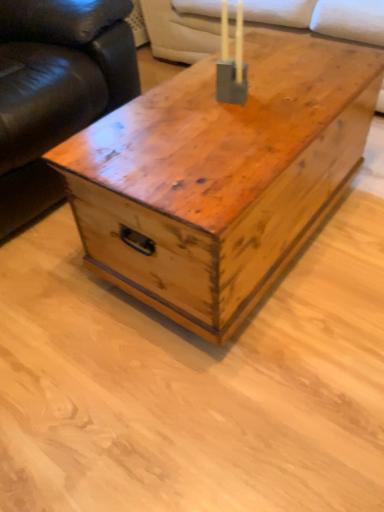
Describe the element at coordinates (321, 18) in the screenshot. I see `suede-like beige couch at upper center` at that location.

In order to face leather couch at left, should I rotate leftwards or rightwards?

Turn left approximately 25.000 degrees to face it.

Identify the location of wooden trunk at center. tap(220, 177).

What are the coordinates of `candle holder in front of the suede-like beige couch at upper center` in the screenshot? It's located at (231, 63).

From the image's perspective, is suede-like beige couch at upper center positioned above or below matte gray concrete candle holder at center?

suede-like beige couch at upper center is above matte gray concrete candle holder at center.

Considering the sizes of objects suede-like beige couch at upper center and matte gray concrete candle holder at center in the image provided, who is wider, suede-like beige couch at upper center or matte gray concrete candle holder at center?

With larger width is suede-like beige couch at upper center.

How different are the orientations of suede-like beige couch at upper center and matte gray concrete candle holder at center in degrees?

There is a 90.6-degree angle between the facing directions of suede-like beige couch at upper center and matte gray concrete candle holder at center.

Choose the correct answer: Is suede-like beige couch at upper center inside wooden trunk at center or outside it?

suede-like beige couch at upper center is located beyond the bounds of wooden trunk at center.

Does suede-like beige couch at upper center have a greater width compared to wooden trunk at center?

Correct, the width of suede-like beige couch at upper center exceeds that of wooden trunk at center.

Which object is positioned more to the right, suede-like beige couch at upper center or wooden trunk at center?

Positioned to the right is suede-like beige couch at upper center.

Does suede-like beige couch at upper center come behind wooden trunk at center?

Yes, it is behind wooden trunk at center.

Is matte gray concrete candle holder at center oriented away from suede-like beige couch at upper center?

That's not correct — matte gray concrete candle holder at center is not looking away from suede-like beige couch at upper center.

Which object is positioned more to the right, matte gray concrete candle holder at center or suede-like beige couch at upper center?

suede-like beige couch at upper center is more to the right.

From the image's perspective, which object appears higher, matte gray concrete candle holder at center or suede-like beige couch at upper center?

suede-like beige couch at upper center.

Considering the relative sizes of matte gray concrete candle holder at center and suede-like beige couch at upper center in the image provided, is matte gray concrete candle holder at center wider than suede-like beige couch at upper center?

No.

Does leather couch at left appear on the right side of suede-like beige couch at upper center?

No.

In terms of size, does leather couch at left appear bigger or smaller than suede-like beige couch at upper center?

Considering their sizes, leather couch at left takes up less space than suede-like beige couch at upper center.

Can you confirm if leather couch at left is shorter than suede-like beige couch at upper center?

No.

Considering the relative sizes of leather couch at left and suede-like beige couch at upper center in the image provided, is leather couch at left wider than suede-like beige couch at upper center?

Yes.

How different are the orientations of wooden trunk at center and suede-like beige couch at upper center in degrees?

87.7 degrees.

Who is bigger, wooden trunk at center or suede-like beige couch at upper center?

With larger size is suede-like beige couch at upper center.

Would you say suede-like beige couch at upper center is part of wooden trunk at center's contents?

No, suede-like beige couch at upper center is not inside wooden trunk at center.

Which object is more forward, wooden trunk at center or suede-like beige couch at upper center?

wooden trunk at center is in front.

From the picture: Can you confirm if leather couch at left is wider than wooden trunk at center?

Yes, leather couch at left is wider than wooden trunk at center.

From a real-world perspective, is leather couch at left physically located above or below wooden trunk at center?

leather couch at left is above wooden trunk at center.

From the image's perspective, is leather couch at left positioned above or below wooden trunk at center?

Clearly, from the image's perspective, leather couch at left is above wooden trunk at center.

Relative to leather couch at left, is wooden trunk at center in front or behind?

wooden trunk at center is positioned closer to the viewer than leather couch at left.

From a real-world perspective, is wooden trunk at center located beneath leather couch at left?

Yes, from a real-world perspective, wooden trunk at center is below leather couch at left.

Between wooden trunk at center and leather couch at left, which one has larger size?

leather couch at left is bigger.

From the image's perspective, is wooden trunk at center located above leather couch at left?

No, from the image's perspective, wooden trunk at center is not on top of leather couch at left.

You are a GUI agent. You are given a task and a screenshot of the screen. Output one action in this format:
    pyautogui.click(x=<x>, y=<y>)
    Task: Click on the couch behind the matte gray concrete candle holder at center
    This screenshot has height=512, width=384.
    Given the screenshot: What is the action you would take?
    pyautogui.click(x=321, y=18)

What are the coordinates of `couch that is on the right side of wooden trunk at center` in the screenshot? It's located at click(321, 18).

Estimate the real-world distances between objects in this image. Which object is closer to suede-like beige couch at upper center, wooden trunk at center or matte gray concrete candle holder at center?

matte gray concrete candle holder at center is positioned closer to the anchor suede-like beige couch at upper center.

Considering their positions, is suede-like beige couch at upper center positioned further to wooden trunk at center than leather couch at left?

Based on the image, suede-like beige couch at upper center appears to be further to wooden trunk at center.

Based on their spatial positions, is suede-like beige couch at upper center or wooden trunk at center further from leather couch at left?

Among the two, suede-like beige couch at upper center is located further to leather couch at left.

Estimate the real-world distances between objects in this image. Which object is further from wooden trunk at center, matte gray concrete candle holder at center or leather couch at left?

The object further to wooden trunk at center is leather couch at left.

Looking at the image, which one is located further to leather couch at left, wooden trunk at center or matte gray concrete candle holder at center?

The object further to leather couch at left is matte gray concrete candle holder at center.

Which object lies nearer to the anchor point leather couch at left, suede-like beige couch at upper center or matte gray concrete candle holder at center?

The object closer to leather couch at left is matte gray concrete candle holder at center.

Considering their positions, is matte gray concrete candle holder at center positioned closer to leather couch at left than suede-like beige couch at upper center?

Among the two, matte gray concrete candle holder at center is located nearer to leather couch at left.

Looking at this image, which object lies nearer to the anchor point suede-like beige couch at upper center, matte gray concrete candle holder at center or leather couch at left?

leather couch at left is positioned closer to the anchor suede-like beige couch at upper center.

At what (x,y) coordinates should I click in order to perform the action: click on candle holder between leather couch at left and suede-like beige couch at upper center in the horizontal direction. Please return your answer as a coordinate pair (x, y). The width and height of the screenshot is (384, 512). Looking at the image, I should click on (231, 63).

You are a GUI agent. You are given a task and a screenshot of the screen. Output one action in this format:
    pyautogui.click(x=<x>, y=<y>)
    Task: Click on the table between leather couch at left and suede-like beige couch at upper center
    The height and width of the screenshot is (512, 384).
    Given the screenshot: What is the action you would take?
    pyautogui.click(x=220, y=177)

Locate an element on the screen. The width and height of the screenshot is (384, 512). candle holder between suede-like beige couch at upper center and wooden trunk at center in the vertical direction is located at coordinates [231, 63].

The image size is (384, 512). I want to click on candle holder between leather couch at left and wooden trunk at center, so click(x=231, y=63).